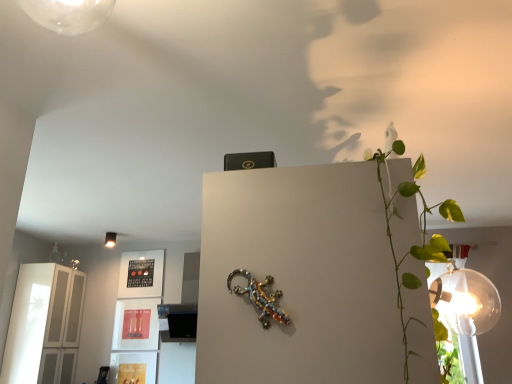
Question: From the image's perspective, would you say metallic beaded lizard at center is shown under white glossy cabinet at left?

Choices:
 (A) no
 (B) yes

Answer: (A)

Question: Does metallic beaded lizard at center have a smaller size compared to white glossy cabinet at left?

Choices:
 (A) no
 (B) yes

Answer: (B)

Question: Does metallic beaded lizard at center appear on the right side of white glossy cabinet at left?

Choices:
 (A) yes
 (B) no

Answer: (A)

Question: Is metallic beaded lizard at center oriented towards white glossy cabinet at left?

Choices:
 (A) no
 (B) yes

Answer: (A)

Question: Considering the relative sizes of metallic beaded lizard at center and white glossy cabinet at left in the image provided, is metallic beaded lizard at center bigger than white glossy cabinet at left?

Choices:
 (A) no
 (B) yes

Answer: (A)

Question: Which is correct: metallic beaded lizard at center is inside matte white lampshade at upper left, or outside of it?

Choices:
 (A) outside
 (B) inside

Answer: (A)

Question: Looking at their shapes, would you say metallic beaded lizard at center is wider or thinner than matte white lampshade at upper left?

Choices:
 (A) thin
 (B) wide

Answer: (A)

Question: From a real-world perspective, is metallic beaded lizard at center above or below matte white lampshade at upper left?

Choices:
 (A) above
 (B) below

Answer: (B)

Question: Is point [266, 319] positioned closer to the camera than point [113, 241]?

Choices:
 (A) closer
 (B) farther

Answer: (A)

Question: In the image, is matte white lampshade at upper left positioned in front of or behind white glossy cabinet at left?

Choices:
 (A) front
 (B) behind

Answer: (B)

Question: From their relative heights in the image, would you say matte white lampshade at upper left is taller or shorter than white glossy cabinet at left?

Choices:
 (A) short
 (B) tall

Answer: (A)

Question: From the image's perspective, is matte white lampshade at upper left above or below white glossy cabinet at left?

Choices:
 (A) below
 (B) above

Answer: (B)

Question: Is point (113, 238) closer or farther from the camera than point (16, 367)?

Choices:
 (A) farther
 (B) closer

Answer: (A)

Question: From the image's perspective, relative to white glossy cabinet at left, is metallic beaded lizard at center above or below?

Choices:
 (A) below
 (B) above

Answer: (B)

Question: Does point (240, 291) appear closer or farther from the camera than point (75, 340)?

Choices:
 (A) closer
 (B) farther

Answer: (A)